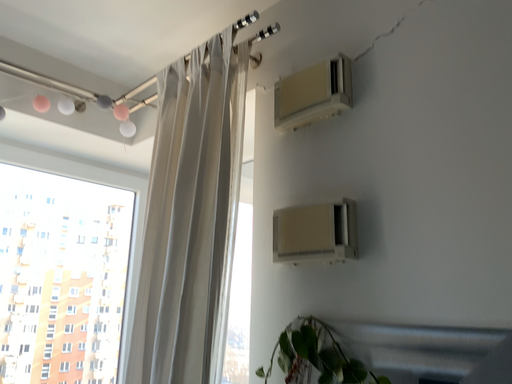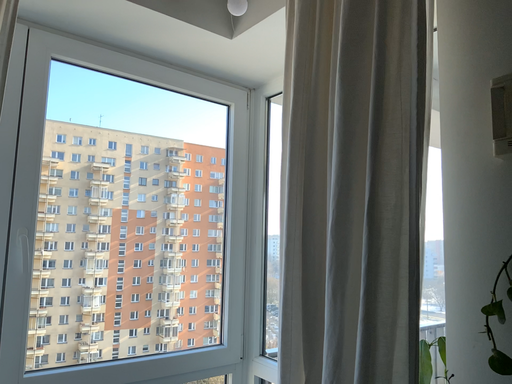
Question: How did the camera likely rotate when shooting the video?

Choices:
 (A) rotated upward
 (B) rotated downward

Answer: (B)